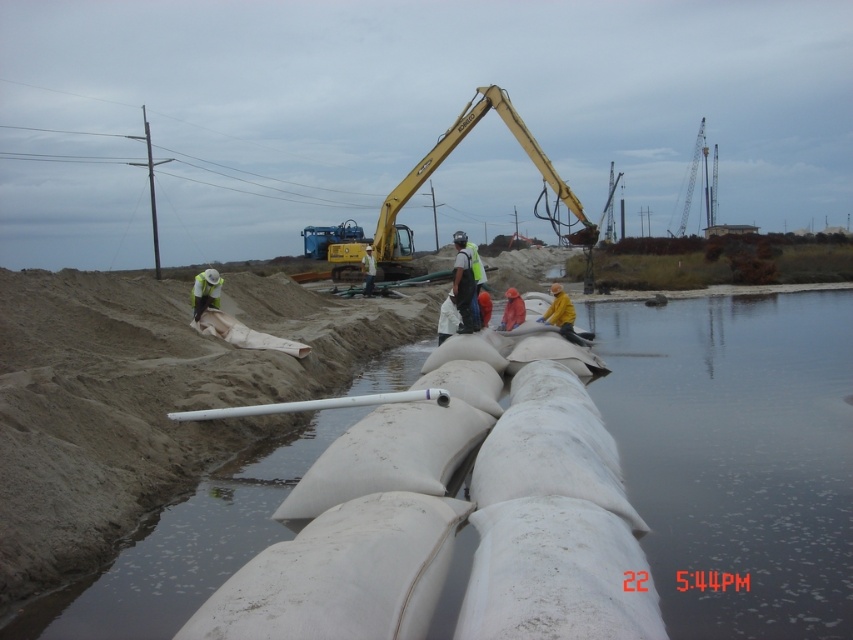
Question: Which point is closer to the camera?

Choices:
 (A) yellow metallic excavator at center
 (B) white matte pipe at center
 (C) reflective silver helmet at center
 (D) clear water at lower right

Answer: (D)

Question: Does yellow metallic excavator at center appear on the right side of reflective silver helmet at center?

Choices:
 (A) yes
 (B) no

Answer: (A)

Question: Estimate the real-world distances between objects in this image. Which object is closer to the white matte pipe at center?

Choices:
 (A) yellow metallic excavator at center
 (B) reflective silver helmet at center
 (C) clear water at lower right

Answer: (C)

Question: Is clear water at lower right bigger than reflective silver helmet at center?

Choices:
 (A) no
 (B) yes

Answer: (B)

Question: Does yellow metallic excavator at center appear on the right side of white matte pipe at center?

Choices:
 (A) no
 (B) yes

Answer: (B)

Question: Which object appears closest to the camera in this image?

Choices:
 (A) yellow metallic excavator at center
 (B) white matte pipe at center

Answer: (B)